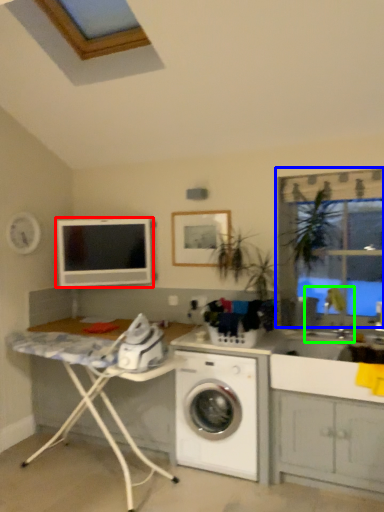
Question: Based on their relative distances, which object is nearer to computer monitor (highlighted by a red box)? Choose from window frame (highlighted by a blue box) and sink (highlighted by a green box).

Choices:
 (A) window frame
 (B) sink

Answer: (A)